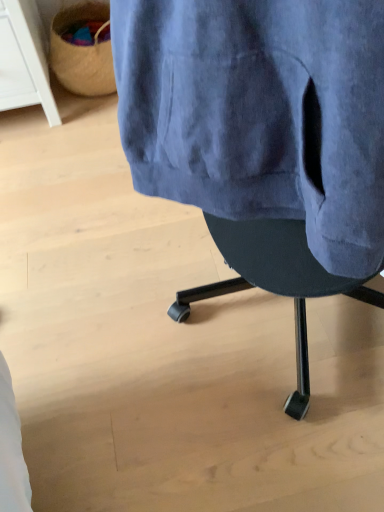
What do you see at coordinates (260, 114) in the screenshot? Image resolution: width=384 pixels, height=512 pixels. I see `denim jeans at center` at bounding box center [260, 114].

Find the location of a particular element. denim jeans at center is located at coordinates (260, 114).

Image resolution: width=384 pixels, height=512 pixels. I want to click on denim jeans at center, so click(260, 114).